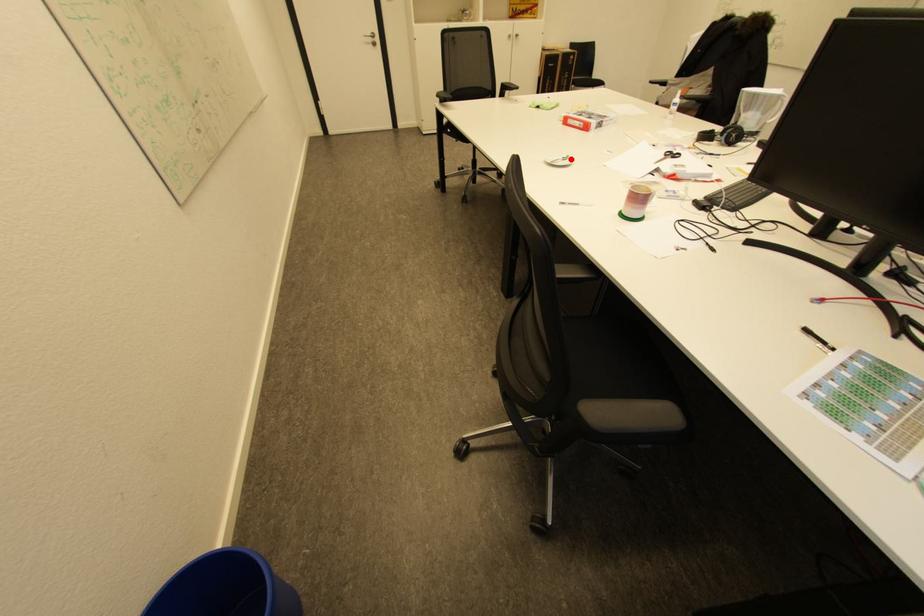
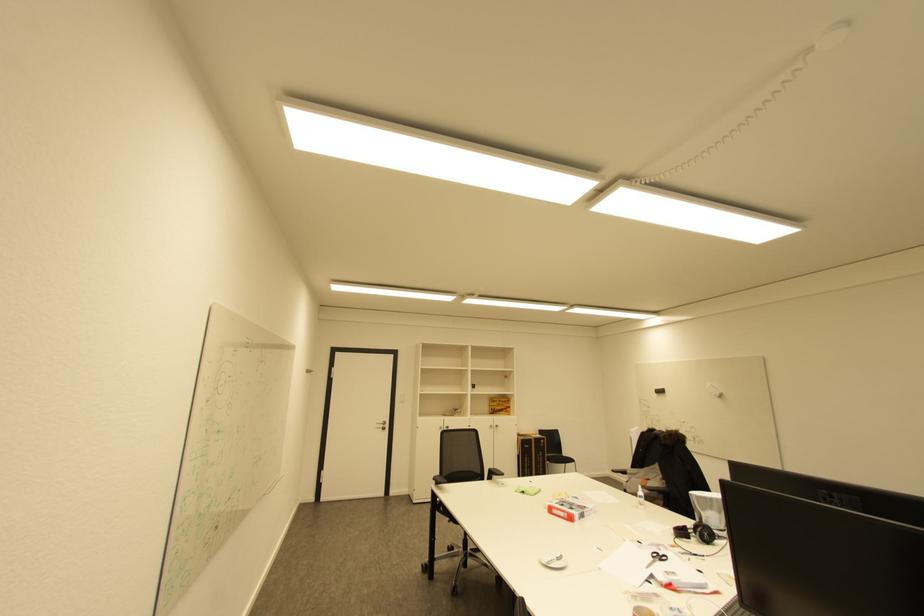
In the second image, find the point that corresponds to the highlighted location in the first image.

(564, 559)